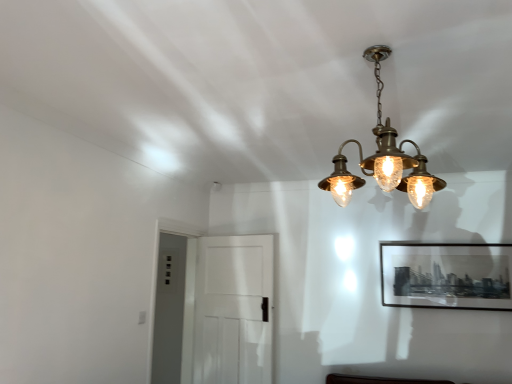
Question: Is point (326, 188) closer or farther from the camera than point (217, 339)?

Choices:
 (A) closer
 (B) farther

Answer: (A)

Question: Looking at their shapes, would you say brass/bronze chandelier at upper center is wider or thinner than white matte door at center?

Choices:
 (A) thin
 (B) wide

Answer: (B)

Question: Considering the real-world distances, which object is closest to the brass/bronze chandelier at upper center?

Choices:
 (A) black matte picture frame at upper right
 (B) white matte door at center

Answer: (A)

Question: Which object is positioned closest to the brass/bronze chandelier at upper center?

Choices:
 (A) black matte picture frame at upper right
 (B) white matte door at center

Answer: (A)